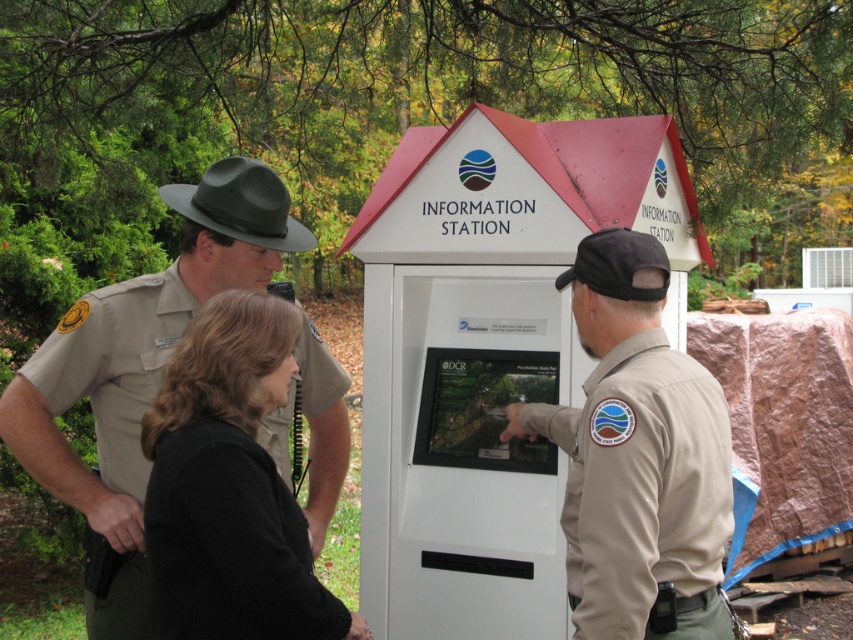
Who is positioned more to the right, tan uniform at left or black fabric jacket at center?

From the viewer's perspective, black fabric jacket at center appears more on the right side.

Where is `tan uniform at left`? Image resolution: width=853 pixels, height=640 pixels. tan uniform at left is located at coordinates (138, 368).

Where is `tan uniform at left`? tan uniform at left is located at coordinates (138, 368).

Is point (589, 524) positioned behind point (73, 506)?

No, it is in front of (73, 506).

Is tan uniform at center shorter than tan uniform at left?

Correct, tan uniform at center is not as tall as tan uniform at left.

Is point (694, 573) farther from camera compared to point (126, 442)?

No, it is not.

You are a GUI agent. You are given a task and a screenshot of the screen. Output one action in this format:
    pyautogui.click(x=<x>, y=<y>)
    Task: Click on the tan uniform at center
    This screenshot has width=853, height=640.
    Given the screenshot: What is the action you would take?
    pyautogui.click(x=637, y=458)

Can you confirm if tan uniform at center is bigger than black fabric jacket at center?

Indeed, tan uniform at center has a larger size compared to black fabric jacket at center.

Can you confirm if tan uniform at center is positioned above black fabric jacket at center?

Actually, tan uniform at center is below black fabric jacket at center.

Does point (619, 605) lie in front of point (184, 616)?

No, it is not.

Locate an element on the screen. tan uniform at center is located at coordinates (637, 458).